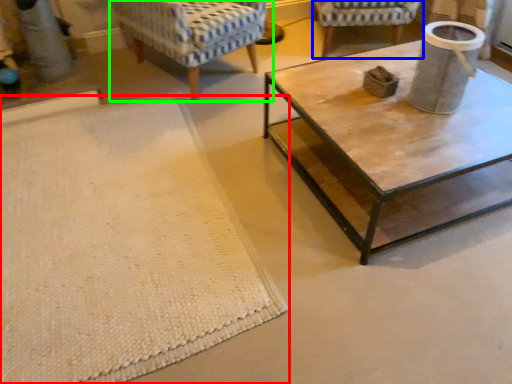
Question: Which is nearer to the mat (highlighted by a red box)? chair (highlighted by a blue box) or chair (highlighted by a green box).

Choices:
 (A) chair
 (B) chair

Answer: (B)